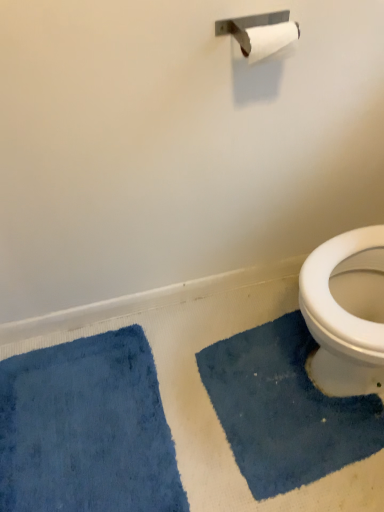
What do you see at coordinates (86, 429) in the screenshot? The image size is (384, 512). I see `blue plush bath mat at lower left, placed as the 1th bath mat when sorted from left to right` at bounding box center [86, 429].

You are a GUI agent. You are given a task and a screenshot of the screen. Output one action in this format:
    pyautogui.click(x=<x>, y=<y>)
    Task: Click on the blue plush bath mat at lower left, placed as the 1th bath mat when sorted from left to right
    The image size is (384, 512).
    Given the screenshot: What is the action you would take?
    pyautogui.click(x=86, y=429)

Measure the distance between blue plush bath mat at lower left, which appears as the 2th bath mat when viewed from the right, and camera.

1.08 meters.

At what (x,y) coordinates should I click in order to perform the action: click on blue plush bath mat at lower right, the second bath mat from the left. Please return your answer as a coordinate pair (x, y). The width and height of the screenshot is (384, 512). Looking at the image, I should click on (284, 409).

What do you see at coordinates (284, 409) in the screenshot? The height and width of the screenshot is (512, 384). I see `blue plush bath mat at lower right, the second bath mat from the left` at bounding box center [284, 409].

Identify the location of blue plush bath mat at lower left, which appears as the 2th bath mat when viewed from the right. The height and width of the screenshot is (512, 384). (86, 429).

Does blue plush bath mat at lower right, arranged as the first bath mat when viewed from the right, appear on the right side of blue plush bath mat at lower left, which appears as the 2th bath mat when viewed from the right?

Yes, blue plush bath mat at lower right, arranged as the first bath mat when viewed from the right, is to the right of blue plush bath mat at lower left, which appears as the 2th bath mat when viewed from the right.

In the image, is blue plush bath mat at lower right, the second bath mat from the left, positioned in front of or behind blue plush bath mat at lower left, which appears as the 2th bath mat when viewed from the right?

Clearly, blue plush bath mat at lower right, the second bath mat from the left, is behind blue plush bath mat at lower left, which appears as the 2th bath mat when viewed from the right.

Considering the points (280, 367) and (30, 361), which point is in front, point (280, 367) or point (30, 361)?

The point (280, 367) is more forward.

From the image's perspective, is blue plush bath mat at lower right, arranged as the first bath mat when viewed from the right, beneath blue plush bath mat at lower left, placed as the 1th bath mat when sorted from left to right?

No, from the image's perspective, blue plush bath mat at lower right, arranged as the first bath mat when viewed from the right, is not below blue plush bath mat at lower left, placed as the 1th bath mat when sorted from left to right.

From a real-world perspective, relative to blue plush bath mat at lower left, which appears as the 2th bath mat when viewed from the right, is blue plush bath mat at lower right, the second bath mat from the left, vertically above or below?

From a real-world perspective, blue plush bath mat at lower right, the second bath mat from the left, is physically below blue plush bath mat at lower left, which appears as the 2th bath mat when viewed from the right.

Considering the relative sizes of blue plush bath mat at lower right, the second bath mat from the left, and blue plush bath mat at lower left, which appears as the 2th bath mat when viewed from the right, in the image provided, is blue plush bath mat at lower right, the second bath mat from the left, wider than blue plush bath mat at lower left, which appears as the 2th bath mat when viewed from the right,?

In fact, blue plush bath mat at lower right, the second bath mat from the left, might be narrower than blue plush bath mat at lower left, which appears as the 2th bath mat when viewed from the right.

Considering the sizes of objects blue plush bath mat at lower right, arranged as the first bath mat when viewed from the right, and blue plush bath mat at lower left, placed as the 1th bath mat when sorted from left to right, in the image provided, who is taller, blue plush bath mat at lower right, arranged as the first bath mat when viewed from the right, or blue plush bath mat at lower left, placed as the 1th bath mat when sorted from left to right,?

With more height is blue plush bath mat at lower right, arranged as the first bath mat when viewed from the right.

Considering the sizes of blue plush bath mat at lower right, the second bath mat from the left, and blue plush bath mat at lower left, which appears as the 2th bath mat when viewed from the right, in the image, is blue plush bath mat at lower right, the second bath mat from the left, bigger or smaller than blue plush bath mat at lower left, which appears as the 2th bath mat when viewed from the right,?

blue plush bath mat at lower right, the second bath mat from the left, is smaller than blue plush bath mat at lower left, which appears as the 2th bath mat when viewed from the right.

Is blue plush bath mat at lower left, which appears as the 2th bath mat when viewed from the right, completely or partially inside blue plush bath mat at lower right, the second bath mat from the left?

No, blue plush bath mat at lower left, which appears as the 2th bath mat when viewed from the right, is not a part of blue plush bath mat at lower right, the second bath mat from the left.

From the picture: Is blue plush bath mat at lower right, arranged as the first bath mat when viewed from the right, far from blue plush bath mat at lower left, which appears as the 2th bath mat when viewed from the right?

They are positioned close to each other.

Is blue plush bath mat at lower right, the second bath mat from the left, oriented towards blue plush bath mat at lower left, placed as the 1th bath mat when sorted from left to right?

Yes, blue plush bath mat at lower right, the second bath mat from the left, is facing blue plush bath mat at lower left, placed as the 1th bath mat when sorted from left to right.

How different are the orientations of blue plush bath mat at lower right, arranged as the first bath mat when viewed from the right, and blue plush bath mat at lower left, placed as the 1th bath mat when sorted from left to right, in degrees?

There is a 7.64-degree angle between the facing directions of blue plush bath mat at lower right, arranged as the first bath mat when viewed from the right, and blue plush bath mat at lower left, placed as the 1th bath mat when sorted from left to right.

Could you measure the distance between blue plush bath mat at lower right, arranged as the first bath mat when viewed from the right, and blue plush bath mat at lower left, placed as the 1th bath mat when sorted from left to right?

blue plush bath mat at lower right, arranged as the first bath mat when viewed from the right, and blue plush bath mat at lower left, placed as the 1th bath mat when sorted from left to right, are 13.91 inches apart from each other.

Where is `bath mat beneath the blue plush bath mat at lower left, which appears as the 2th bath mat when viewed from the right (from a real-world perspective)`? bath mat beneath the blue plush bath mat at lower left, which appears as the 2th bath mat when viewed from the right (from a real-world perspective) is located at coordinates (284, 409).

Between blue plush bath mat at lower left, placed as the 1th bath mat when sorted from left to right, and blue plush bath mat at lower right, the second bath mat from the left, which one appears on the right side from the viewer's perspective?

blue plush bath mat at lower right, the second bath mat from the left, is more to the right.

Is the position of blue plush bath mat at lower left, which appears as the 2th bath mat when viewed from the right, more distant than that of blue plush bath mat at lower right, the second bath mat from the left?

No, blue plush bath mat at lower left, which appears as the 2th bath mat when viewed from the right, is in front of blue plush bath mat at lower right, the second bath mat from the left.

Does point (117, 483) come closer to viewer compared to point (324, 424)?

Yes, point (117, 483) is in front of point (324, 424).

From the picture: From the image's perspective, is blue plush bath mat at lower left, placed as the 1th bath mat when sorted from left to right, located beneath blue plush bath mat at lower right, the second bath mat from the left?

Correct, blue plush bath mat at lower left, placed as the 1th bath mat when sorted from left to right, appears lower than blue plush bath mat at lower right, the second bath mat from the left, in the image.

From a real-world perspective, is blue plush bath mat at lower left, which appears as the 2th bath mat when viewed from the right, on top of blue plush bath mat at lower right, the second bath mat from the left?

Yes, from a real-world perspective, blue plush bath mat at lower left, which appears as the 2th bath mat when viewed from the right, is over blue plush bath mat at lower right, the second bath mat from the left

Considering the sizes of blue plush bath mat at lower left, which appears as the 2th bath mat when viewed from the right, and blue plush bath mat at lower right, arranged as the first bath mat when viewed from the right, in the image, is blue plush bath mat at lower left, which appears as the 2th bath mat when viewed from the right, wider or thinner than blue plush bath mat at lower right, arranged as the first bath mat when viewed from the right,?

Considering their sizes, blue plush bath mat at lower left, which appears as the 2th bath mat when viewed from the right, looks broader than blue plush bath mat at lower right, arranged as the first bath mat when viewed from the right.

Is blue plush bath mat at lower left, which appears as the 2th bath mat when viewed from the right, shorter than blue plush bath mat at lower right, arranged as the first bath mat when viewed from the right?

Correct, blue plush bath mat at lower left, which appears as the 2th bath mat when viewed from the right, is not as tall as blue plush bath mat at lower right, arranged as the first bath mat when viewed from the right.

Is blue plush bath mat at lower left, which appears as the 2th bath mat when viewed from the right, bigger or smaller than blue plush bath mat at lower right, the second bath mat from the left?

In the image, blue plush bath mat at lower left, which appears as the 2th bath mat when viewed from the right, appears to be larger than blue plush bath mat at lower right, the second bath mat from the left.

Choose the correct answer: Is blue plush bath mat at lower left, placed as the 1th bath mat when sorted from left to right, inside blue plush bath mat at lower right, the second bath mat from the left, or outside it?

blue plush bath mat at lower left, placed as the 1th bath mat when sorted from left to right, lies outside blue plush bath mat at lower right, the second bath mat from the left.

Does blue plush bath mat at lower left, placed as the 1th bath mat when sorted from left to right, touch blue plush bath mat at lower right, the second bath mat from the left?

No, blue plush bath mat at lower left, placed as the 1th bath mat when sorted from left to right, is not beside blue plush bath mat at lower right, the second bath mat from the left.

Is blue plush bath mat at lower left, placed as the 1th bath mat when sorted from left to right, looking in the opposite direction of blue plush bath mat at lower right, arranged as the first bath mat when viewed from the right?

Yes, blue plush bath mat at lower right, arranged as the first bath mat when viewed from the right, is at the back of blue plush bath mat at lower left, placed as the 1th bath mat when sorted from left to right.

At what (x,y) coordinates should I click in order to perform the action: click on bath mat that appears below the blue plush bath mat at lower left, placed as the 1th bath mat when sorted from left to right (from a real-world perspective). Please return your answer as a coordinate pair (x, y). Looking at the image, I should click on (284, 409).

Find the location of a particular element. bath mat located on the right of blue plush bath mat at lower left, placed as the 1th bath mat when sorted from left to right is located at coordinates (284, 409).

I want to click on bath mat above the blue plush bath mat at lower left, which appears as the 2th bath mat when viewed from the right (from the image's perspective), so [x=284, y=409].